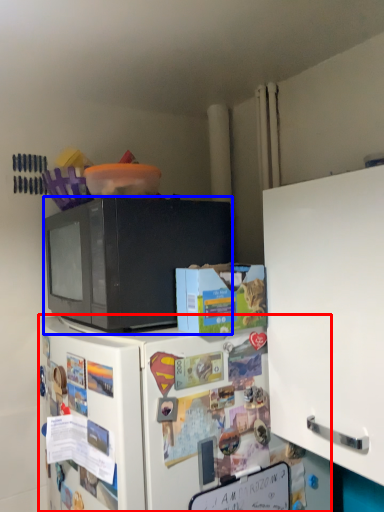
Question: Among these objects, which one is nearest to the camera, refrigerator (highlighted by a red box) or microwave oven (highlighted by a blue box)?

Choices:
 (A) refrigerator
 (B) microwave oven

Answer: (A)